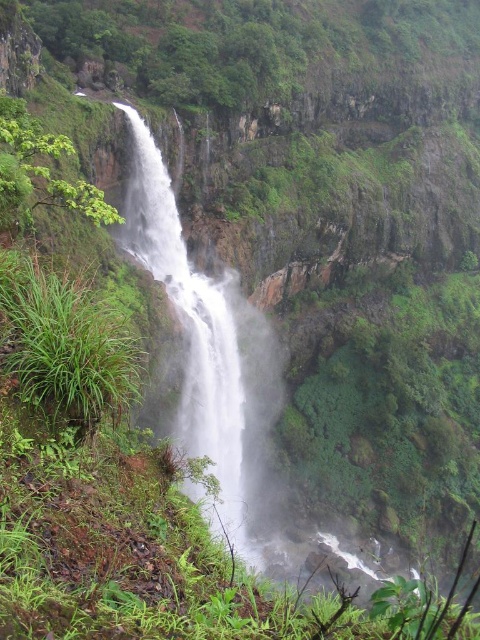
Which is more to the right, green leafy vegetation at upper center or green leafy plant at left?

From the viewer's perspective, green leafy vegetation at upper center appears more on the right side.

Is green leafy vegetation at upper center smaller than green leafy plant at left?

No, green leafy vegetation at upper center is not smaller than green leafy plant at left.

The width and height of the screenshot is (480, 640). Identify the location of green leafy vegetation at upper center. (255, 42).

This screenshot has height=640, width=480. In order to click on green leafy vegetation at upper center in this screenshot , I will do `click(255, 42)`.

Does white misty waterfall at center lie behind green leafy plant at left?

No.

Where is `white misty waterfall at center`? The height and width of the screenshot is (640, 480). white misty waterfall at center is located at coordinates (207, 355).

Identify the location of white misty waterfall at center. This screenshot has height=640, width=480. (207, 355).

What do you see at coordinates (255, 42) in the screenshot?
I see `green leafy vegetation at upper center` at bounding box center [255, 42].

Does green leafy vegetation at upper center appear on the left side of white misty waterfall at center?

Incorrect, green leafy vegetation at upper center is not on the left side of white misty waterfall at center.

Where is `green leafy vegetation at upper center`? This screenshot has height=640, width=480. green leafy vegetation at upper center is located at coordinates [x=255, y=42].

Image resolution: width=480 pixels, height=640 pixels. I want to click on green leafy vegetation at upper center, so click(x=255, y=42).